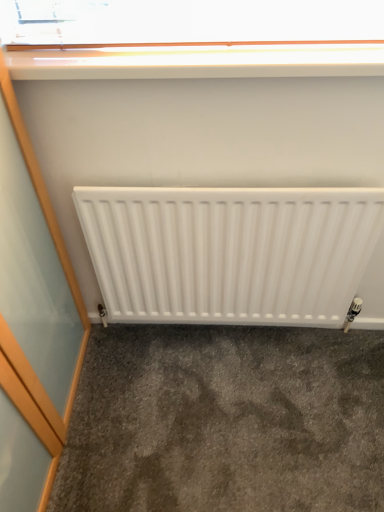
Question: Are white glossy window sill at upper center and white matte radiator at center located far from each other?

Choices:
 (A) yes
 (B) no

Answer: (B)

Question: From the image's perspective, is white glossy window sill at upper center on white matte radiator at center?

Choices:
 (A) yes
 (B) no

Answer: (A)

Question: From the image's perspective, would you say white glossy window sill at upper center is shown under white matte radiator at center?

Choices:
 (A) yes
 (B) no

Answer: (B)

Question: Could you tell me if white glossy window sill at upper center is turned towards white matte radiator at center?

Choices:
 (A) no
 (B) yes

Answer: (A)

Question: From a real-world perspective, is white glossy window sill at upper center located higher than white matte radiator at center?

Choices:
 (A) yes
 (B) no

Answer: (A)

Question: Is gray carpet at lower center spatially inside white matte radiator at center, or outside of it?

Choices:
 (A) outside
 (B) inside

Answer: (A)

Question: Is gray carpet at lower center in front of or behind white matte radiator at center in the image?

Choices:
 (A) front
 (B) behind

Answer: (B)

Question: From the image's perspective, is gray carpet at lower center positioned above or below white matte radiator at center?

Choices:
 (A) above
 (B) below

Answer: (B)

Question: From a real-world perspective, is gray carpet at lower center physically located above or below white matte radiator at center?

Choices:
 (A) below
 (B) above

Answer: (A)

Question: From the image's perspective, is white glossy window sill at upper center located above or below white matte radiator at center?

Choices:
 (A) above
 (B) below

Answer: (A)

Question: From a real-world perspective, is white glossy window sill at upper center above or below white matte radiator at center?

Choices:
 (A) above
 (B) below

Answer: (A)

Question: Considering their positions, is white glossy window sill at upper center located in front of or behind white matte radiator at center?

Choices:
 (A) behind
 (B) front

Answer: (B)

Question: Considering the positions of white glossy window sill at upper center and white matte radiator at center in the image, is white glossy window sill at upper center taller or shorter than white matte radiator at center?

Choices:
 (A) tall
 (B) short

Answer: (B)

Question: From their relative heights in the image, would you say white matte radiator at center is taller or shorter than gray carpet at lower center?

Choices:
 (A) short
 (B) tall

Answer: (B)

Question: Is white matte radiator at center inside or outside of gray carpet at lower center?

Choices:
 (A) outside
 (B) inside

Answer: (A)